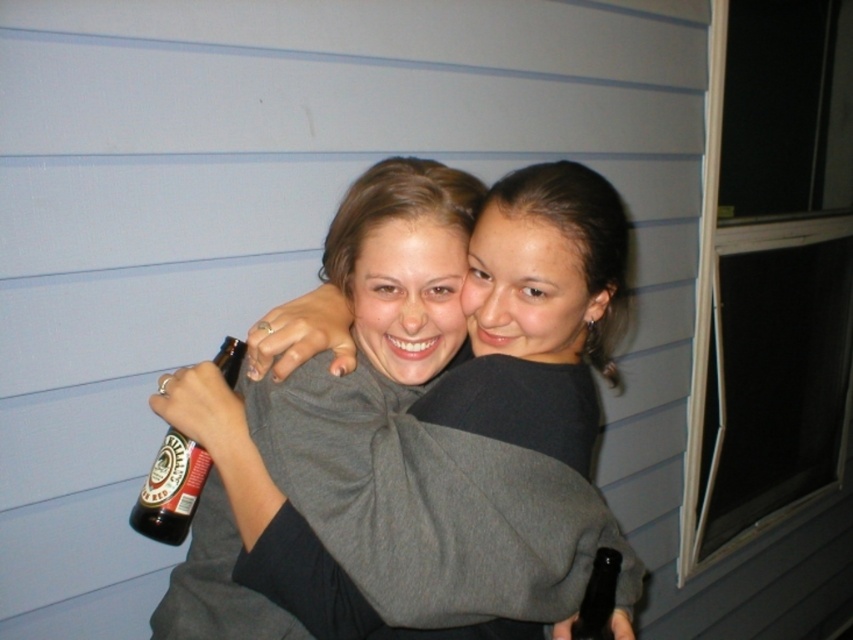
Question: Does gray soft sweater at center appear over dark brown glass bottle at center?

Choices:
 (A) yes
 (B) no

Answer: (A)

Question: Which point is farther to the camera?

Choices:
 (A) (141, 497)
 (B) (595, 630)

Answer: (A)

Question: Which point is closer to the camera?

Choices:
 (A) brown glass beer bottle at lower left
 (B) dark brown glass bottle at center
 (C) gray soft sweater at center

Answer: (B)

Question: Which object is closer to the camera taking this photo?

Choices:
 (A) dark brown glass bottle at center
 (B) gray soft sweater at center
 (C) brown glass beer bottle at lower left

Answer: (A)

Question: Does brown glass beer bottle at lower left have a greater width compared to dark brown glass bottle at center?

Choices:
 (A) no
 (B) yes

Answer: (B)

Question: Is gray soft sweater at center smaller than brown glass beer bottle at lower left?

Choices:
 (A) no
 (B) yes

Answer: (A)